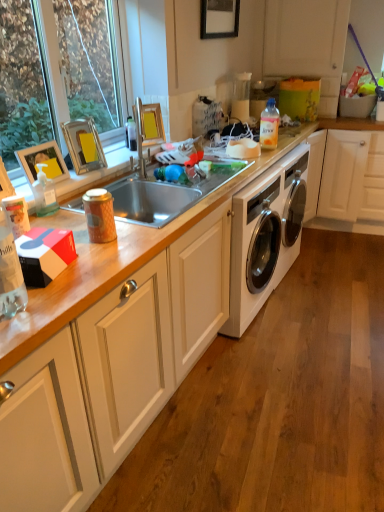
Question: Should I look upward or downward to see yellow cardboard picture frame at upper center, acting as the second picture frame starting from the top?

Choices:
 (A) down
 (B) up

Answer: (B)

Question: Can you confirm if metallic silver picture frame at upper left, marked as the first picture frame in a bottom-to-top arrangement, is bigger than white matte cabinet at lower left, the 2th cabinetry viewed from the top?

Choices:
 (A) yes
 (B) no

Answer: (B)

Question: Can you confirm if metallic silver picture frame at upper left, marked as the first picture frame in a front-to-back arrangement, is wider than white matte cabinet at lower left, the 2th cabinetry viewed from the top?

Choices:
 (A) no
 (B) yes

Answer: (A)

Question: From the image's perspective, would you say metallic silver picture frame at upper left, which is the 4th picture frame in top-to-bottom order, is shown under white matte cabinet at lower left, acting as the 1th cabinetry starting from the bottom?

Choices:
 (A) yes
 (B) no

Answer: (B)

Question: Is metallic silver picture frame at upper left, which is the 1th picture frame in left-to-right order, shorter than white matte cabinet at lower left, acting as the 1th cabinetry starting from the bottom?

Choices:
 (A) yes
 (B) no

Answer: (B)

Question: From a real-world perspective, is metallic silver picture frame at upper left, which is the 1th picture frame in left-to-right order, below white matte cabinet at lower left, the 2th cabinetry viewed from the top?

Choices:
 (A) yes
 (B) no

Answer: (B)

Question: Can we say metallic silver picture frame at upper left, marked as the first picture frame in a bottom-to-top arrangement, lies outside white matte cabinet at lower left, acting as the 1th cabinetry starting from the bottom?

Choices:
 (A) yes
 (B) no

Answer: (A)

Question: Is translucent plastic bottle at upper right, which is counted as the first bottle, starting from the back, with white glossy washing machine at center?

Choices:
 (A) yes
 (B) no

Answer: (B)

Question: Does translucent plastic bottle at upper right, which is counted as the second bottle, starting from the front, have a lesser width compared to white glossy washing machine at center?

Choices:
 (A) yes
 (B) no

Answer: (A)

Question: Would you say translucent plastic bottle at upper right, which is the second bottle from left to right, is outside white glossy washing machine at center?

Choices:
 (A) no
 (B) yes

Answer: (B)

Question: Is translucent plastic bottle at upper right, which is counted as the second bottle, starting from the front, shorter than white glossy washing machine at center?

Choices:
 (A) yes
 (B) no

Answer: (A)

Question: Is translucent plastic bottle at upper right, which is the second bottle from left to right, bigger than white glossy washing machine at center?

Choices:
 (A) no
 (B) yes

Answer: (A)

Question: From a real-world perspective, is translucent plastic bottle at upper right, which appears as the 1th bottle when viewed from the top, located beneath white glossy washing machine at center?

Choices:
 (A) no
 (B) yes

Answer: (A)

Question: Is yellow cardboard picture frame at upper center, acting as the second picture frame starting from the top, behind clear glass window at upper left?

Choices:
 (A) no
 (B) yes

Answer: (B)